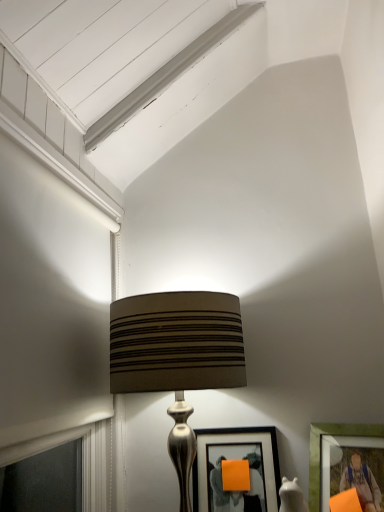
Question: Can you confirm if matte brown fabric lampshade at center is taller than matte black picture frame at center, acting as the second picture frame starting from the right?

Choices:
 (A) no
 (B) yes

Answer: (B)

Question: Does matte brown fabric lampshade at center have a lesser height compared to matte black picture frame at center, acting as the second picture frame starting from the right?

Choices:
 (A) no
 (B) yes

Answer: (A)

Question: Can you confirm if matte brown fabric lampshade at center is positioned to the left of matte black picture frame at center, the first picture frame when ordered from left to right?

Choices:
 (A) yes
 (B) no

Answer: (A)

Question: From a real-world perspective, is matte brown fabric lampshade at center under matte black picture frame at center, the first picture frame when ordered from left to right?

Choices:
 (A) yes
 (B) no

Answer: (B)

Question: Is matte brown fabric lampshade at center far from matte black picture frame at center, acting as the second picture frame starting from the right?

Choices:
 (A) no
 (B) yes

Answer: (A)

Question: Is matte brown fabric lampshade at center next to matte black picture frame at center, the first picture frame when ordered from left to right, and touching it?

Choices:
 (A) no
 (B) yes

Answer: (A)

Question: Considering the relative positions of matte green picture frame at lower right, which is the 1th picture frame from right to left, and matte black picture frame at center, the first picture frame when ordered from left to right, in the image provided, is matte green picture frame at lower right, which is the 1th picture frame from right to left, to the right of matte black picture frame at center, the first picture frame when ordered from left to right, from the viewer's perspective?

Choices:
 (A) yes
 (B) no

Answer: (A)

Question: Can you confirm if matte green picture frame at lower right, which is the 1th picture frame from right to left, is positioned to the left of matte black picture frame at center, acting as the second picture frame starting from the right?

Choices:
 (A) no
 (B) yes

Answer: (A)

Question: Considering the relative sizes of matte green picture frame at lower right, which is the 1th picture frame from right to left, and matte black picture frame at center, acting as the second picture frame starting from the right, in the image provided, is matte green picture frame at lower right, which is the 1th picture frame from right to left, taller than matte black picture frame at center, acting as the second picture frame starting from the right,?

Choices:
 (A) yes
 (B) no

Answer: (B)

Question: Are matte green picture frame at lower right, the 2th picture frame viewed from the left, and matte black picture frame at center, the first picture frame when ordered from left to right, far apart?

Choices:
 (A) yes
 (B) no

Answer: (B)

Question: Does matte green picture frame at lower right, which is the 1th picture frame from right to left, have a smaller size compared to matte black picture frame at center, acting as the second picture frame starting from the right?

Choices:
 (A) no
 (B) yes

Answer: (A)

Question: Would you say matte green picture frame at lower right, which is the 1th picture frame from right to left, contains matte black picture frame at center, acting as the second picture frame starting from the right?

Choices:
 (A) yes
 (B) no

Answer: (B)

Question: From the image's perspective, is matte green picture frame at lower right, which is the 1th picture frame from right to left, located above matte brown fabric lampshade at center?

Choices:
 (A) no
 (B) yes

Answer: (A)